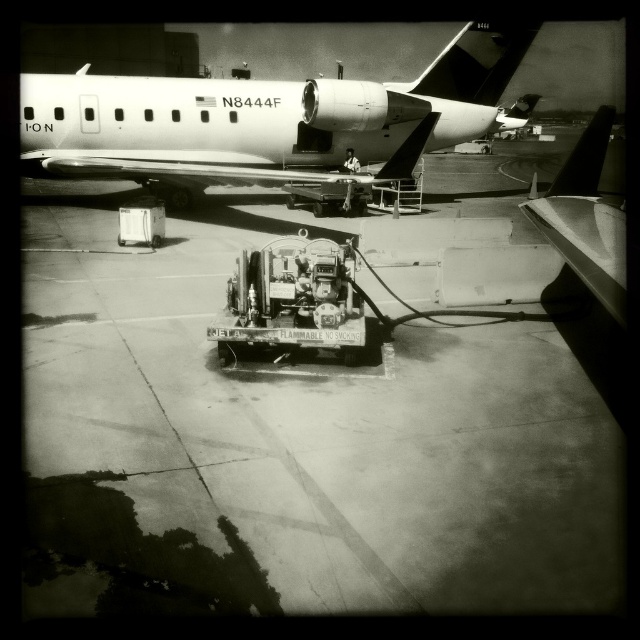
Question: Among these objects, which one is nearest to the camera?

Choices:
 (A) metallic white airplane at upper left
 (B) smooth concrete tarmac at center

Answer: (B)

Question: Can you confirm if smooth concrete tarmac at center is positioned to the left of metallic white airplane at upper left?

Choices:
 (A) yes
 (B) no

Answer: (A)

Question: Where is smooth concrete tarmac at center located in relation to metallic white airplane at upper left in the image?

Choices:
 (A) below
 (B) above

Answer: (A)

Question: Can you confirm if smooth concrete tarmac at center is thinner than metallic white airplane at upper left?

Choices:
 (A) yes
 (B) no

Answer: (A)